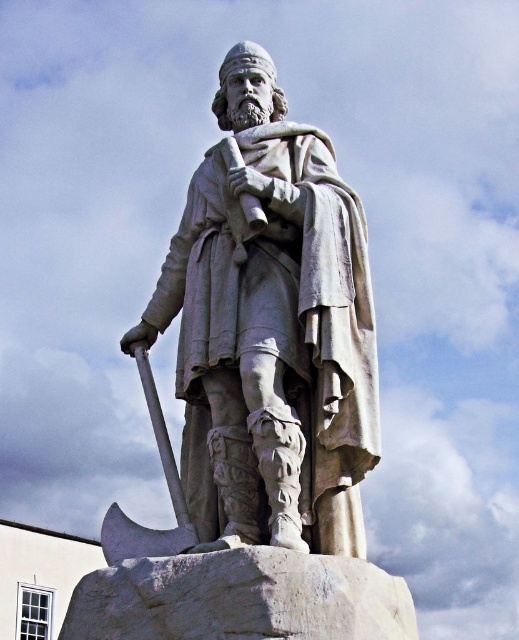
Question: Is white stone statue at center above polished silver axe at lower left?

Choices:
 (A) yes
 (B) no

Answer: (A)

Question: Can you confirm if white stone statue at center is thinner than polished silver axe at lower left?

Choices:
 (A) no
 (B) yes

Answer: (B)

Question: Among these objects, which one is nearest to the camera?

Choices:
 (A) polished silver axe at lower left
 (B) white stone statue at center

Answer: (B)

Question: Is white stone statue at center positioned in front of polished silver axe at lower left?

Choices:
 (A) yes
 (B) no

Answer: (A)

Question: Which of the following is the farthest from the observer?

Choices:
 (A) polished silver axe at lower left
 (B) white stone statue at center

Answer: (A)